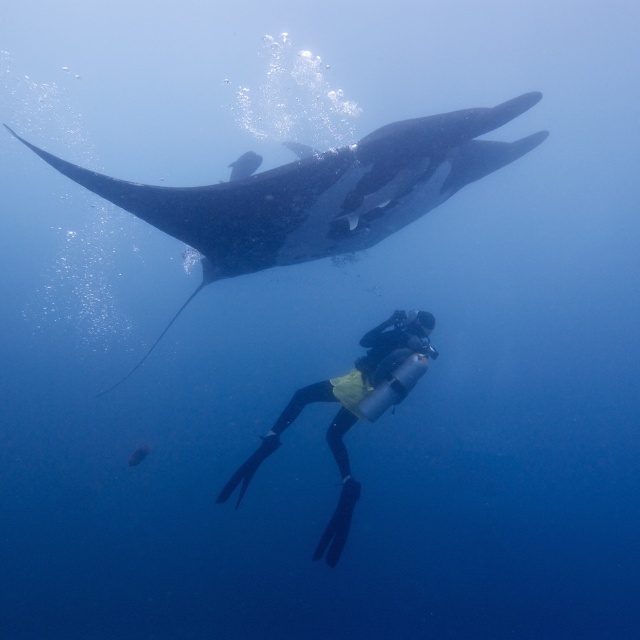
Is point (384, 177) behind point (368, 348)?

Yes, point (384, 177) is farther from viewer.

Locate an element on the screen. The width and height of the screenshot is (640, 640). dark gray matte stingray at upper center is located at coordinates (317, 193).

Does point (308, 220) come farther from viewer compared to point (317, 385)?

Yes, point (308, 220) is behind point (317, 385).

Image resolution: width=640 pixels, height=640 pixels. What are the coordinates of `dark gray matte stingray at upper center` in the screenshot? It's located at (317, 193).